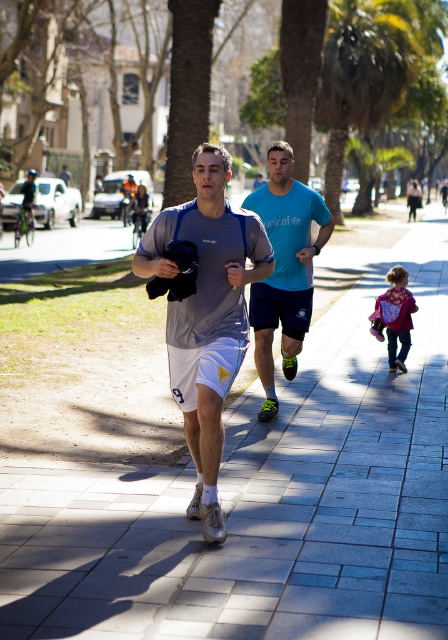
You are standing at the starting point of the jogging path and want to reach the green leafy palm tree at center. Which direction should you head towards?

The green leafy palm tree at center is located at point coordinates [361,76], so you should head towards the center of the image to reach it.

You are standing on the gray concrete pavement at center and want to hand the gray fabric shirt at center to someone behind you. Can you reach them without moving your feet?

The gray concrete pavement at center is closer to the viewer than the gray fabric shirt at center, so the shirt is further away. Since the shirt is behind you, you can reach behind to hand it to the person behind without needing to move your feet.